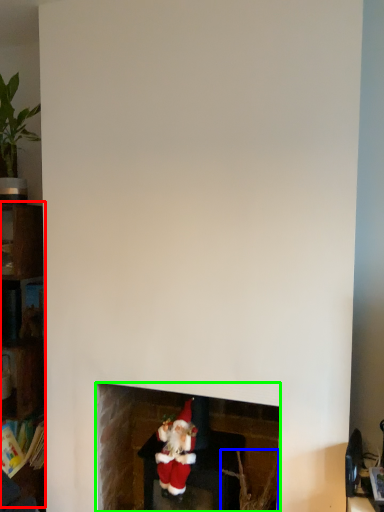
Question: Based on their relative distances, which object is farther from shelf (highlighted by a red box)? Choose from plant (highlighted by a blue box) and fireplace (highlighted by a green box).

Choices:
 (A) plant
 (B) fireplace

Answer: (A)